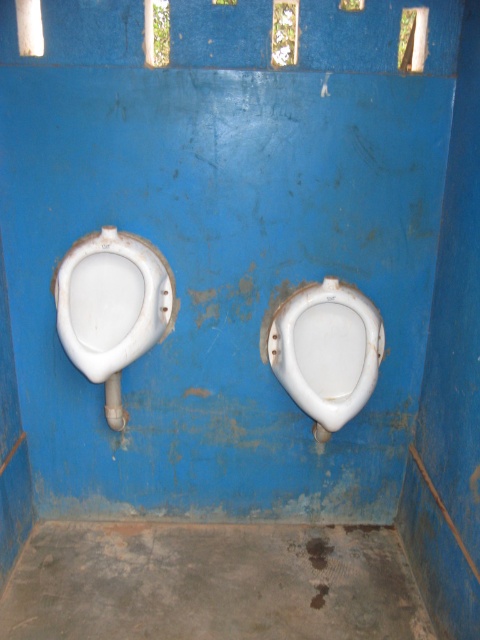
Describe the element at coordinates (111, 307) in the screenshot. I see `white glossy urinal at left` at that location.

Is point (157, 298) positioned behind point (354, 316)?

No, it is not.

You are a GUI agent. You are given a task and a screenshot of the screen. Output one action in this format:
    pyautogui.click(x=<x>, y=<y>)
    Task: Click on the white glossy urinal at left
    This screenshot has width=480, height=640.
    Given the screenshot: What is the action you would take?
    pyautogui.click(x=111, y=307)